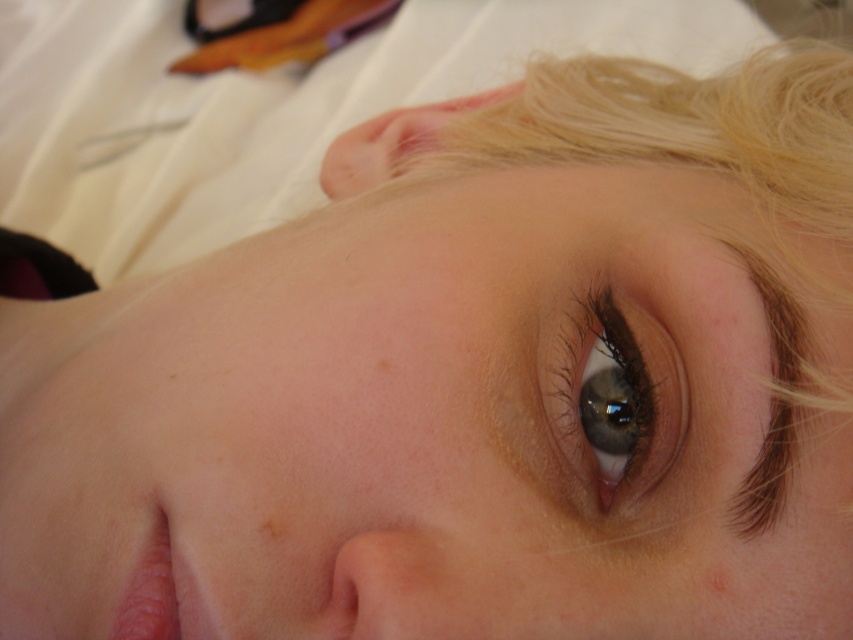
Image resolution: width=853 pixels, height=640 pixels. Describe the element at coordinates (685, 168) in the screenshot. I see `blonde hair at upper right` at that location.

Between point (810, 406) and point (607, 317), which one is positioned in front?

Positioned in front is point (810, 406).

This screenshot has height=640, width=853. Identify the location of blonde hair at upper right. (x=685, y=168).

The image size is (853, 640). Identify the location of blonde hair at upper right. (685, 168).